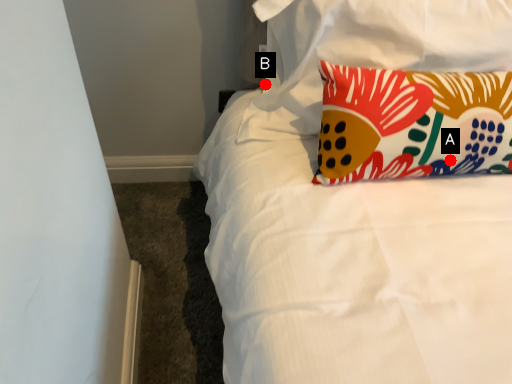
Question: Two points are circled on the image, labeled by A and B beside each circle. Among these points, which one is nearest to the camera?

Choices:
 (A) A is closer
 (B) B is closer

Answer: (A)